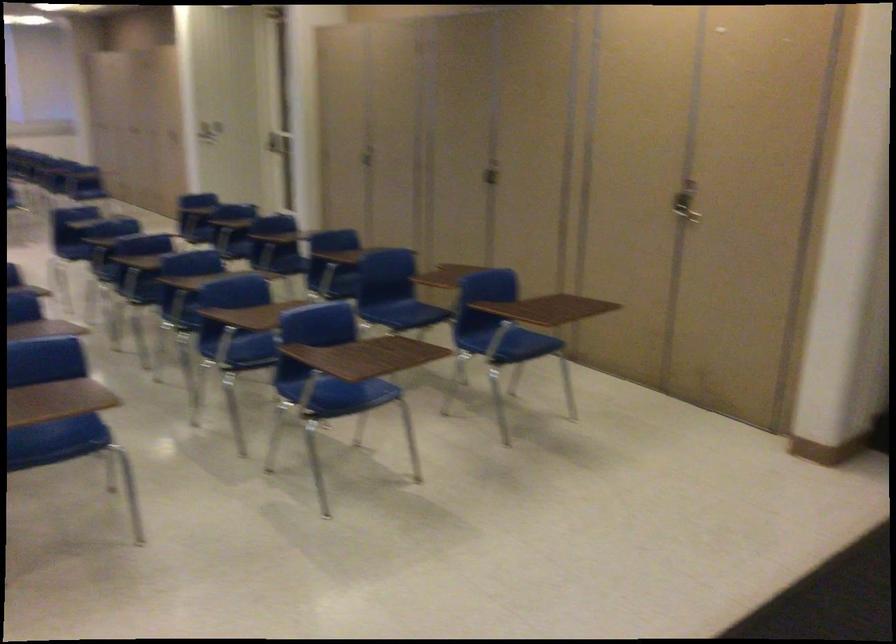
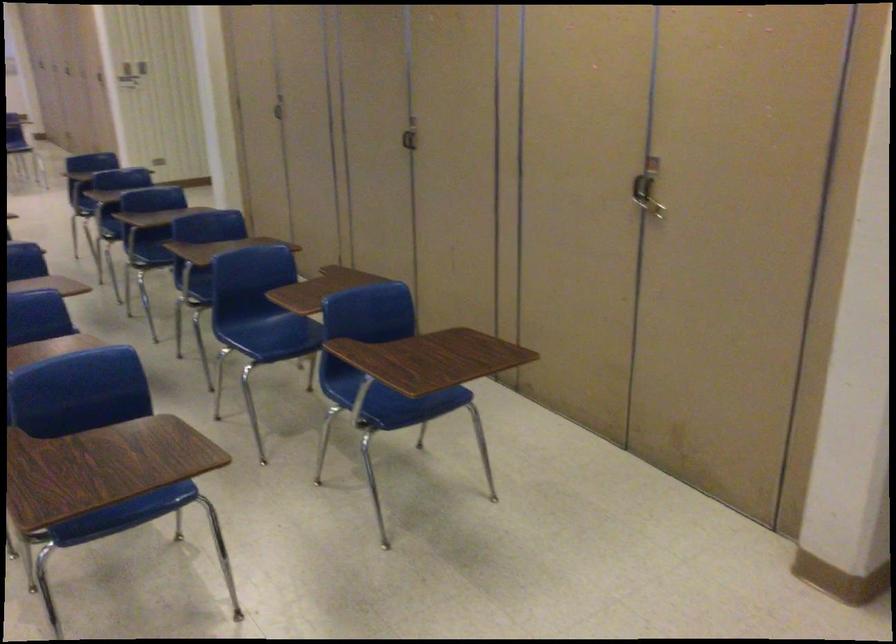
In the second image, find the point that corresponds to pixel 366 149 in the first image.

(279, 107)